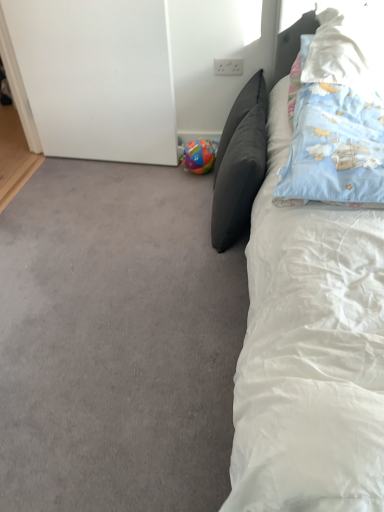
You are a GUI agent. You are given a task and a screenshot of the screen. Output one action in this format:
    pyautogui.click(x=<x>, y=<y>)
    Task: Click on the vacant area that lies in front of dark gray cushion at center, which is counted as the first pillow, starting from the left
    The height and width of the screenshot is (512, 384).
    Given the screenshot: What is the action you would take?
    pyautogui.click(x=198, y=272)